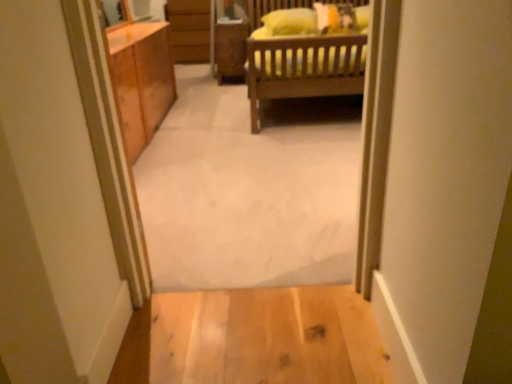
Question: Can light wood floor at lower center, arranged as the 1th plain when ordered from the bottom, be found inside carpet at center, the first plain positioned from the top?

Choices:
 (A) no
 (B) yes

Answer: (A)

Question: Can you confirm if carpet at center, which is the second plain from bottom to top, is shorter than light wood floor at lower center, the 2th plain viewed from the top?

Choices:
 (A) yes
 (B) no

Answer: (B)

Question: From the image's perspective, would you say carpet at center, which is the second plain from bottom to top, is positioned over light wood floor at lower center, arranged as the 1th plain when ordered from the bottom?

Choices:
 (A) yes
 (B) no

Answer: (A)

Question: From a real-world perspective, is carpet at center, the first plain positioned from the top, located higher than light wood floor at lower center, the 2th plain viewed from the top?

Choices:
 (A) no
 (B) yes

Answer: (B)

Question: Is carpet at center, which is the second plain from bottom to top, outside of light wood floor at lower center, the 2th plain viewed from the top?

Choices:
 (A) no
 (B) yes

Answer: (B)

Question: Are carpet at center, the first plain positioned from the top, and light wood floor at lower center, the 2th plain viewed from the top, far apart?

Choices:
 (A) no
 (B) yes

Answer: (A)

Question: Considering the relative sizes of carpet at center, which is the second plain from bottom to top, and wooden cabinet at center in the image provided, is carpet at center, which is the second plain from bottom to top, shorter than wooden cabinet at center?

Choices:
 (A) yes
 (B) no

Answer: (B)

Question: Does carpet at center, which is the second plain from bottom to top, have a smaller size compared to wooden cabinet at center?

Choices:
 (A) no
 (B) yes

Answer: (A)

Question: Does carpet at center, which is the second plain from bottom to top, have a greater height compared to wooden cabinet at center?

Choices:
 (A) yes
 (B) no

Answer: (A)

Question: Does carpet at center, which is the second plain from bottom to top, turn towards wooden cabinet at center?

Choices:
 (A) no
 (B) yes

Answer: (B)

Question: Is carpet at center, which is the second plain from bottom to top, bigger than wooden cabinet at center?

Choices:
 (A) yes
 (B) no

Answer: (A)

Question: From the image's perspective, is carpet at center, the first plain positioned from the top, on top of wooden cabinet at center?

Choices:
 (A) no
 (B) yes

Answer: (A)

Question: Is light wood floor at lower center, arranged as the 1th plain when ordered from the bottom, positioned beyond the bounds of carpet at center, which is the second plain from bottom to top?

Choices:
 (A) no
 (B) yes

Answer: (B)